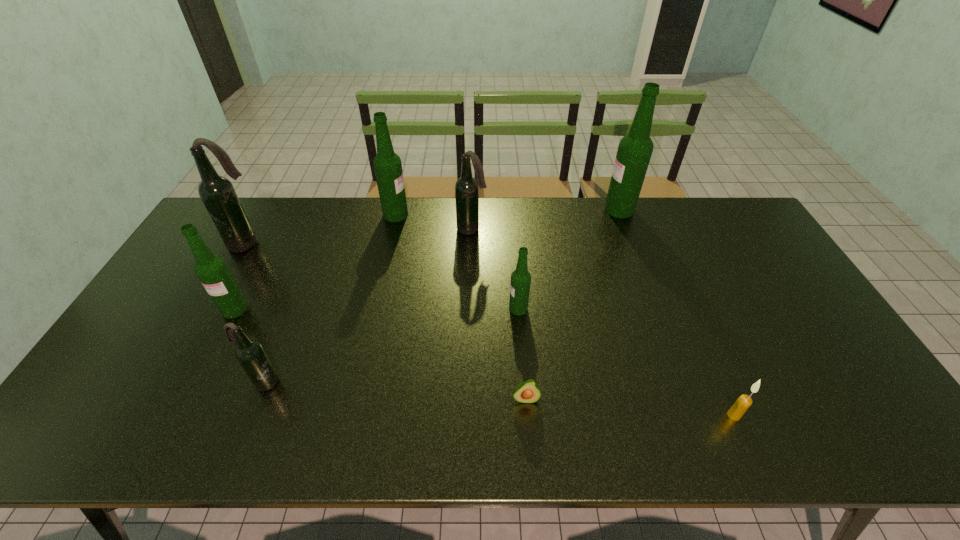
Where is `the rightmost beer bottle`? the rightmost beer bottle is located at coordinates (634, 152).

Locate an element on the screen. The height and width of the screenshot is (540, 960). the tallest object is located at coordinates (634, 152).

This screenshot has height=540, width=960. Find the location of `the third green beer bottle from right to left`. the third green beer bottle from right to left is located at coordinates (387, 164).

Find the location of `the fourth beer bottle from right to left`. the fourth beer bottle from right to left is located at coordinates (387, 164).

I want to click on the biggest dark beer bottle, so click(x=217, y=193).

Find the location of a particular element. The width and height of the screenshot is (960, 540). the rightmost dark beer bottle is located at coordinates (466, 188).

Identify the location of the fifth beer bottle from left to right. (466, 188).

Locate an element on the screen. This screenshot has height=540, width=960. the leftmost green beer bottle is located at coordinates (212, 271).

Where is `the smallest green beer bottle`? the smallest green beer bottle is located at coordinates (520, 283).

Where is `the second beer bottle from right to left`? The width and height of the screenshot is (960, 540). the second beer bottle from right to left is located at coordinates (520, 283).